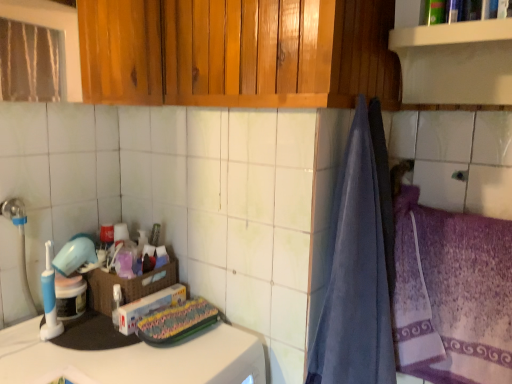
Question: Is shiny wood cabinets at upper center not inside purple textured towel at right?

Choices:
 (A) yes
 (B) no

Answer: (A)

Question: Considering the relative sizes of shiny wood cabinets at upper center and purple textured towel at right in the image provided, is shiny wood cabinets at upper center shorter than purple textured towel at right?

Choices:
 (A) yes
 (B) no

Answer: (A)

Question: From the image's perspective, is shiny wood cabinets at upper center located above purple textured towel at right?

Choices:
 (A) no
 (B) yes

Answer: (B)

Question: Is shiny wood cabinets at upper center aimed at purple textured towel at right?

Choices:
 (A) yes
 (B) no

Answer: (B)

Question: Can you confirm if shiny wood cabinets at upper center is taller than purple textured towel at right?

Choices:
 (A) no
 (B) yes

Answer: (A)

Question: Is shiny wood cabinets at upper center positioned far away from purple textured towel at right?

Choices:
 (A) yes
 (B) no

Answer: (B)

Question: Considering the relative positions of shiny wood cabinets at upper center and blue soft towel at right in the image provided, is shiny wood cabinets at upper center to the right of blue soft towel at right from the viewer's perspective?

Choices:
 (A) yes
 (B) no

Answer: (B)

Question: Is shiny wood cabinets at upper center not near blue soft towel at right?

Choices:
 (A) no
 (B) yes

Answer: (A)

Question: Considering the relative sizes of shiny wood cabinets at upper center and blue soft towel at right in the image provided, is shiny wood cabinets at upper center bigger than blue soft towel at right?

Choices:
 (A) no
 (B) yes

Answer: (A)

Question: Is shiny wood cabinets at upper center oriented towards blue soft towel at right?

Choices:
 (A) yes
 (B) no

Answer: (B)

Question: From the image's perspective, is shiny wood cabinets at upper center above blue soft towel at right?

Choices:
 (A) no
 (B) yes

Answer: (B)

Question: Is blue soft towel at right at the back of shiny wood cabinets at upper center?

Choices:
 (A) yes
 (B) no

Answer: (B)

Question: Is translucent plastic container at center positioned before woven brown basket at center?

Choices:
 (A) no
 (B) yes

Answer: (A)